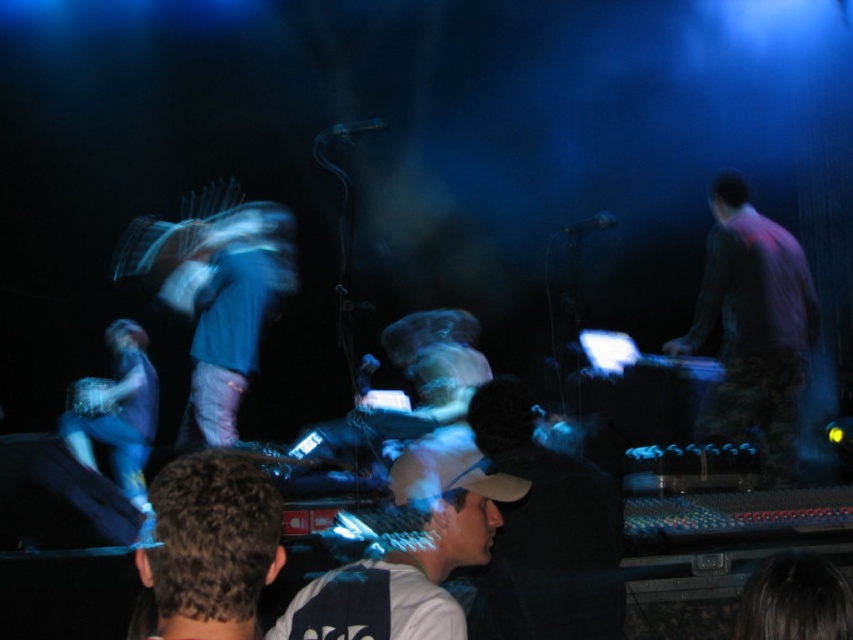
Question: Which point is closer to the camera?

Choices:
 (A) denim pants at left
 (B) white matte cap at center

Answer: (B)

Question: Which of the following is the farthest from the observer?

Choices:
 (A) purple shirt at right
 (B) denim pants at left
 (C) white matte cap at center

Answer: (B)

Question: Is purple shirt at right below denim pants at left?

Choices:
 (A) no
 (B) yes

Answer: (A)

Question: Which of the following is the closest to the observer?

Choices:
 (A) (299, 618)
 (B) (724, 236)

Answer: (A)

Question: Considering the relative positions of purple shirt at right and denim pants at left in the image provided, where is purple shirt at right located with respect to denim pants at left?

Choices:
 (A) left
 (B) right

Answer: (B)

Question: Can you confirm if white matte cap at center is bigger than denim pants at left?

Choices:
 (A) no
 (B) yes

Answer: (A)